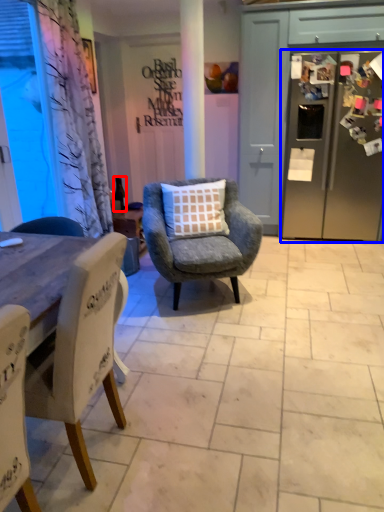
Question: Which of the following is the farthest to the observer, bottle (highlighted by a red box) or refrigerator (highlighted by a blue box)?

Choices:
 (A) bottle
 (B) refrigerator

Answer: (A)